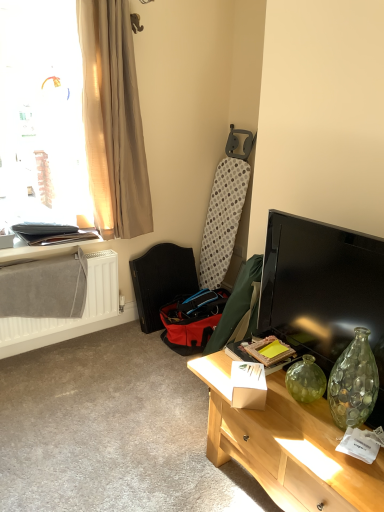
Image resolution: width=384 pixels, height=512 pixels. Identify the location of matte black laptop at left. (48, 247).

Measure the distance between translucent beige curtain at upper left and camera.

The depth of translucent beige curtain at upper left is 2.29 meters.

Image resolution: width=384 pixels, height=512 pixels. What do you see at coordinates (162, 281) in the screenshot?
I see `black leather swivel chair at lower left` at bounding box center [162, 281].

Measure the distance between point (147, 259) and camera.

The depth of point (147, 259) is 9.68 feet.

This screenshot has width=384, height=512. Describe the element at coordinates (287, 446) in the screenshot. I see `light wood desk at lower right` at that location.

Measure the distance between point (374, 241) and camera.

The depth of point (374, 241) is 1.54 meters.

This screenshot has width=384, height=512. In order to click on white textured radiator at left in this screenshot , I will do `click(68, 318)`.

Identify the location of white cardboard box at center. This screenshot has height=512, width=384. (248, 385).

Considering the positions of objects translucent beige curtain at upper left and white textured radiator at left in the image provided, who is more to the right, translucent beige curtain at upper left or white textured radiator at left?

From the viewer's perspective, white textured radiator at left appears more on the right side.

From a real-world perspective, does translucent beige curtain at upper left sit lower than white textured radiator at left?

No, from a real-world perspective, translucent beige curtain at upper left is not under white textured radiator at left.

Locate an element on the screen. The height and width of the screenshot is (512, 384). window screen located above the white textured radiator at left (from a real-world perspective) is located at coordinates (42, 115).

In terms of width, does beige sheer curtain at upper left look wider or thinner when compared to white cardboard box at center?

In the image, beige sheer curtain at upper left appears to be wider than white cardboard box at center.

Is beige sheer curtain at upper left positioned with its back to white cardboard box at center?

beige sheer curtain at upper left is not turned away from white cardboard box at center.

Considering the relative sizes of beige sheer curtain at upper left and white cardboard box at center in the image provided, is beige sheer curtain at upper left bigger than white cardboard box at center?

Yes, beige sheer curtain at upper left is bigger than white cardboard box at center.

From the image's perspective, between beige sheer curtain at upper left and white cardboard box at center, which one is located above?

beige sheer curtain at upper left appears higher in the image.

In terms of size, does white cardboard box at center appear bigger or smaller than white textured radiator at left?

Clearly, white cardboard box at center is smaller in size than white textured radiator at left.

From the image's perspective, which is below, white cardboard box at center or white textured radiator at left?

white cardboard box at center is shown below in the image.

Which point is more distant from viewer, (257, 366) or (26, 329)?

Positioned behind is point (26, 329).

Is black leather swivel chair at lower left located within matte black laptop at left?

That's incorrect, black leather swivel chair at lower left is not inside matte black laptop at left.

From the image's perspective, which object appears higher, matte black laptop at left or black leather swivel chair at lower left?

From the image's view, matte black laptop at left is above.

What are the coordinates of `swivel chair located behind the matte black laptop at left` in the screenshot? It's located at (162, 281).

In terms of size, does matte black laptop at left appear bigger or smaller than black leather swivel chair at lower left?

Considering their sizes, matte black laptop at left takes up less space than black leather swivel chair at lower left.

From a real-world perspective, which object stands above the other?

From a 3D spatial view, translucent beige curtain at upper left is above.

Does translucent beige curtain at upper left have a larger size compared to black leather swivel chair at lower left?

Indeed, translucent beige curtain at upper left has a larger size compared to black leather swivel chair at lower left.

Considering the positions of points (71, 82) and (146, 317), is point (71, 82) farther from camera compared to point (146, 317)?

No, it is in front of (146, 317).

Which object is positioned more to the right, translucent beige curtain at upper left or matte black laptop at left?

matte black laptop at left is more to the right.

Considering the relative sizes of translucent beige curtain at upper left and matte black laptop at left in the image provided, is translucent beige curtain at upper left wider than matte black laptop at left?

Correct, the width of translucent beige curtain at upper left exceeds that of matte black laptop at left.

What are the coordinates of `window sill that appears below the translucent beige curtain at upper left (from a real-world perspective)` in the screenshot? It's located at (48, 247).

Where is `desk located in front of the translucent beige curtain at upper left`? Image resolution: width=384 pixels, height=512 pixels. desk located in front of the translucent beige curtain at upper left is located at coordinates (287, 446).

Is translucent beige curtain at upper left facing away from light wood desk at lower right?

translucent beige curtain at upper left does not have its back to light wood desk at lower right.

Considering the points (58, 160) and (253, 442), which point is in front, point (58, 160) or point (253, 442)?

The point (253, 442) is closer.

Can you confirm if translucent beige curtain at upper left is positioned to the left of light wood desk at lower right?

Yes, translucent beige curtain at upper left is to the left of light wood desk at lower right.

The image size is (384, 512). Find the location of `radiator beneath the translucent beige curtain at upper left (from a real-world perspective)`. radiator beneath the translucent beige curtain at upper left (from a real-world perspective) is located at coordinates tap(68, 318).

Find the location of a particular element. The width and height of the screenshot is (384, 512). box below the beige sheer curtain at upper left (from the image's perspective) is located at coordinates (248, 385).

Estimate the real-world distances between objects in this image. Which object is further from translucent beige curtain at upper left, matte black laptop at left or white cardboard box at center?

Based on the image, white cardboard box at center appears to be further to translucent beige curtain at upper left.

Which object lies nearer to the anchor point beige sheer curtain at upper left, light wood desk at lower right or black leather swivel chair at lower left?

black leather swivel chair at lower left lies closer to beige sheer curtain at upper left than the other object.

When comparing their distances from matte black tv at right, does matte black laptop at left or beige sheer curtain at upper left seem closer?

beige sheer curtain at upper left is positioned closer to the anchor matte black tv at right.

Which object lies nearer to the anchor point white cardboard box at center, beige sheer curtain at upper left or white textured radiator at left?

Among the two, white textured radiator at left is located nearer to white cardboard box at center.

Estimate the real-world distances between objects in this image. Which object is closer to matte black tv at right, white textured radiator at left or beige sheer curtain at upper left?

beige sheer curtain at upper left lies closer to matte black tv at right than the other object.

Considering their positions, is black leather swivel chair at lower left positioned closer to matte black tv at right than light wood desk at lower right?

light wood desk at lower right is positioned closer to the anchor matte black tv at right.

Based on their spatial positions, is translucent beige curtain at upper left or white textured radiator at left further from matte black laptop at left?

translucent beige curtain at upper left.

Based on their spatial positions, is beige sheer curtain at upper left or white textured radiator at left closer to black leather swivel chair at lower left?

white textured radiator at left.

The image size is (384, 512). In order to click on box located between white textured radiator at left and matte black tv at right in the left-right direction in this screenshot , I will do `click(248, 385)`.

Locate an element on the screen. swivel chair between beige sheer curtain at upper left and white textured radiator at left in the up-down direction is located at coordinates (162, 281).

Locate an element on the screen. This screenshot has width=384, height=512. radiator located between matte black laptop at left and white cardboard box at center in the left-right direction is located at coordinates (68, 318).

At what (x,y) coordinates should I click in order to perform the action: click on radiator between translucent beige curtain at upper left and white cardboard box at center vertically. Please return your answer as a coordinate pair (x, y). This screenshot has width=384, height=512. Looking at the image, I should click on (68, 318).